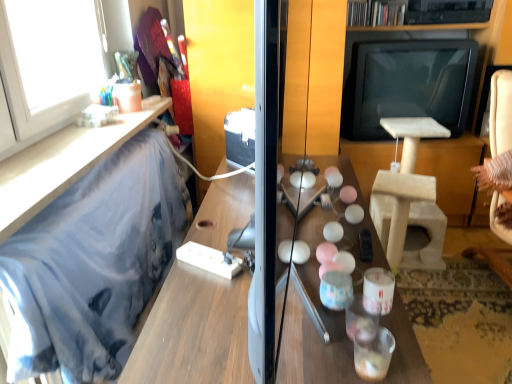
Locate an element on the screen. free spot in front of white glossy candle holder at center is located at coordinates (380, 346).